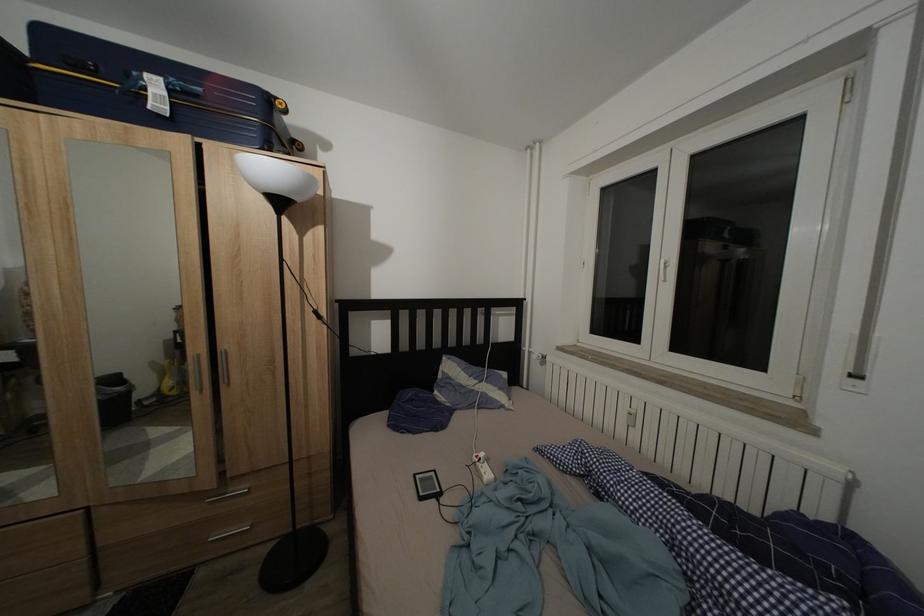
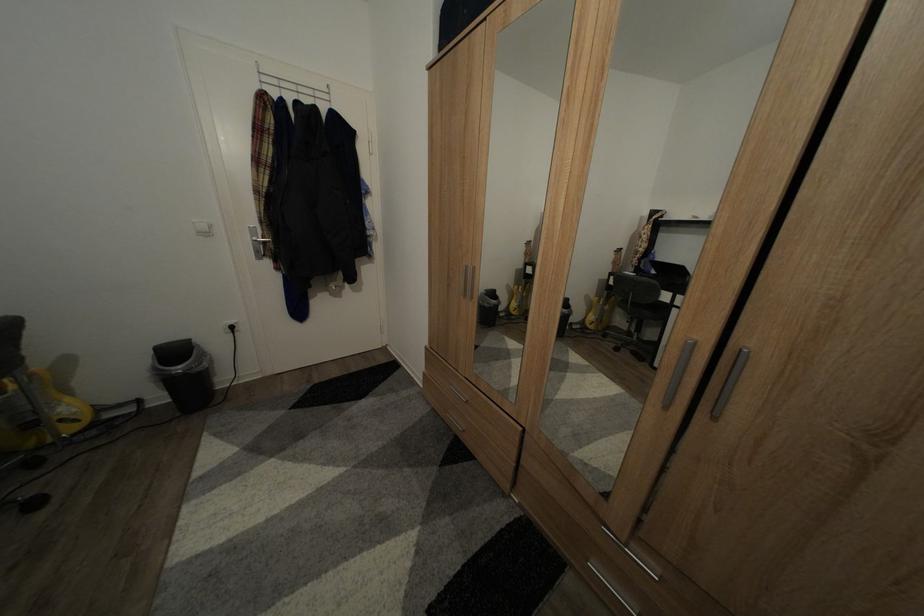
How did the camera likely rotate?

The camera's rotation is toward left-down.